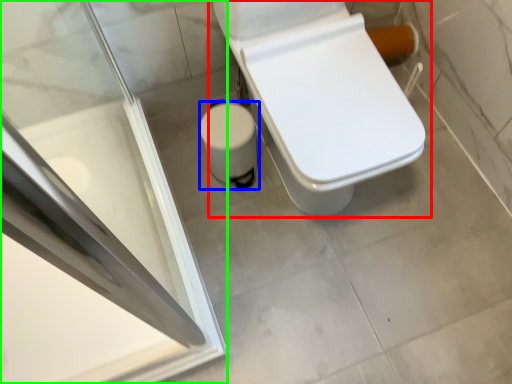
Question: Considering the real-world distances, which object is closest to toilet (highlighted by a red box)? potty (highlighted by a blue box) or screen door (highlighted by a green box).

Choices:
 (A) potty
 (B) screen door

Answer: (A)